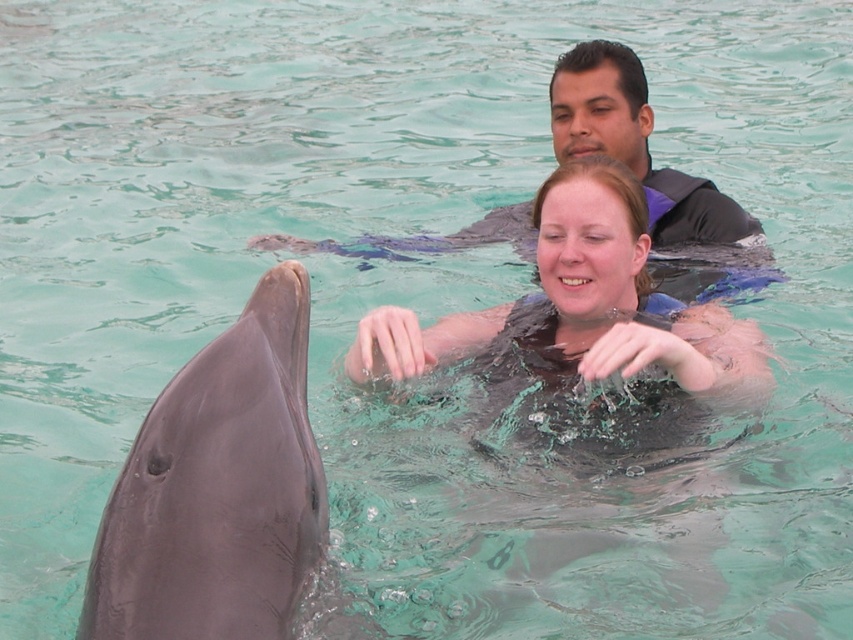
Can you confirm if gray smooth dolphin at left is positioned to the left of smooth black wetsuit at upper center?

Indeed, gray smooth dolphin at left is positioned on the left side of smooth black wetsuit at upper center.

Who is lower down, gray smooth dolphin at left or smooth black wetsuit at upper center?

gray smooth dolphin at left is below.

Is point (136, 584) in front of point (653, 188)?

Yes.

Image resolution: width=853 pixels, height=640 pixels. What are the coordinates of `gray smooth dolphin at left` in the screenshot? It's located at (218, 490).

The image size is (853, 640). What do you see at coordinates (218, 490) in the screenshot?
I see `gray smooth dolphin at left` at bounding box center [218, 490].

Is point (170, 611) farther from camera compared to point (592, 259)?

No, (170, 611) is in front of (592, 259).

At what (x,y) coordinates should I click in order to perform the action: click on gray smooth dolphin at left. Please return your answer as a coordinate pair (x, y). Looking at the image, I should click on [x=218, y=490].

What do you see at coordinates (585, 330) in the screenshot?
I see `black matte wetsuit at center` at bounding box center [585, 330].

Which is more to the left, black matte wetsuit at center or smooth black wetsuit at upper center?

black matte wetsuit at center is more to the left.

Where is `black matte wetsuit at center`? black matte wetsuit at center is located at coordinates (585, 330).